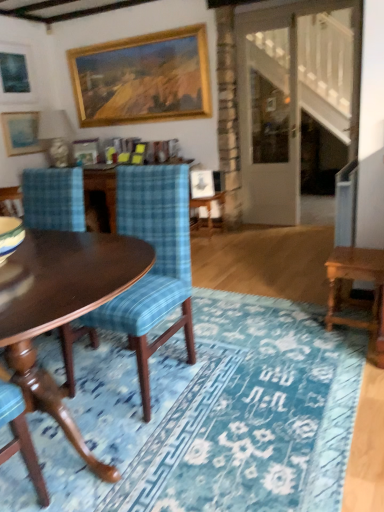
Where is `vacant space to the left of wooden table at right`? This screenshot has height=512, width=384. vacant space to the left of wooden table at right is located at coordinates (305, 328).